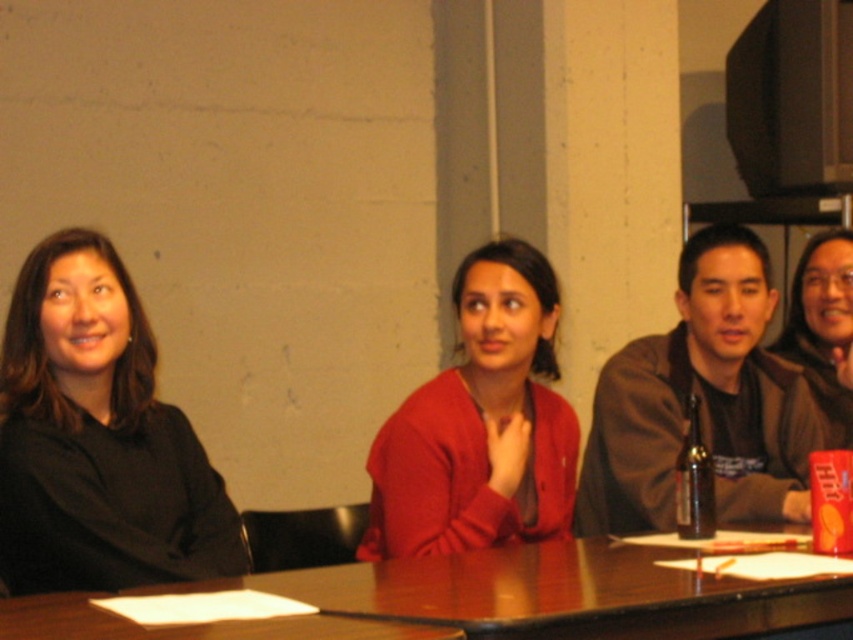
Can you confirm if brown wooden table at center is positioned to the left of matte red sweater at center?

Correct, you'll find brown wooden table at center to the left of matte red sweater at center.

Is brown wooden table at center smaller than matte red sweater at center?

Indeed, brown wooden table at center has a smaller size compared to matte red sweater at center.

Between point (1, 636) and point (410, 490), which one is positioned behind?

The point (410, 490) is behind.

Locate an element on the screen. brown wooden table at center is located at coordinates (479, 600).

Does black matte jacket at left appear under brown wooden table at center?

No, black matte jacket at left is not below brown wooden table at center.

Which is above, black matte jacket at left or brown wooden table at center?

black matte jacket at left is higher up.

Does point (184, 456) come in front of point (772, 625)?

No, (184, 456) is further to viewer.

Find the location of a particular element. The image size is (853, 640). black matte jacket at left is located at coordinates (97, 438).

Who is taller, matte black jacket at center or brown glass bottle at center-right?

Standing taller between the two is matte black jacket at center.

Is point (799, 260) closer to viewer compared to point (692, 451)?

That is False.

This screenshot has width=853, height=640. In order to click on matte black jacket at center in this screenshot , I will do `click(822, 326)`.

Locate an element on the screen. This screenshot has height=640, width=853. matte black jacket at center is located at coordinates (822, 326).